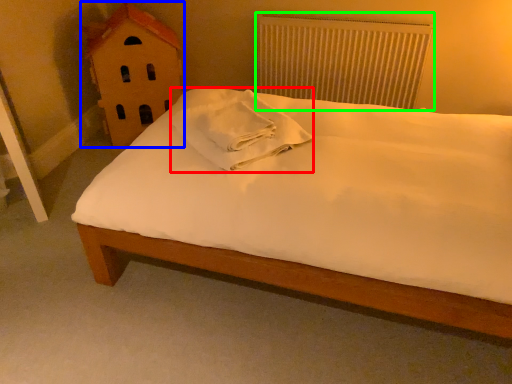
Question: Based on their relative distances, which object is nearer to material (highlighted by a red box)? Choose from toy (highlighted by a blue box) and radiator (highlighted by a green box).

Choices:
 (A) toy
 (B) radiator

Answer: (A)